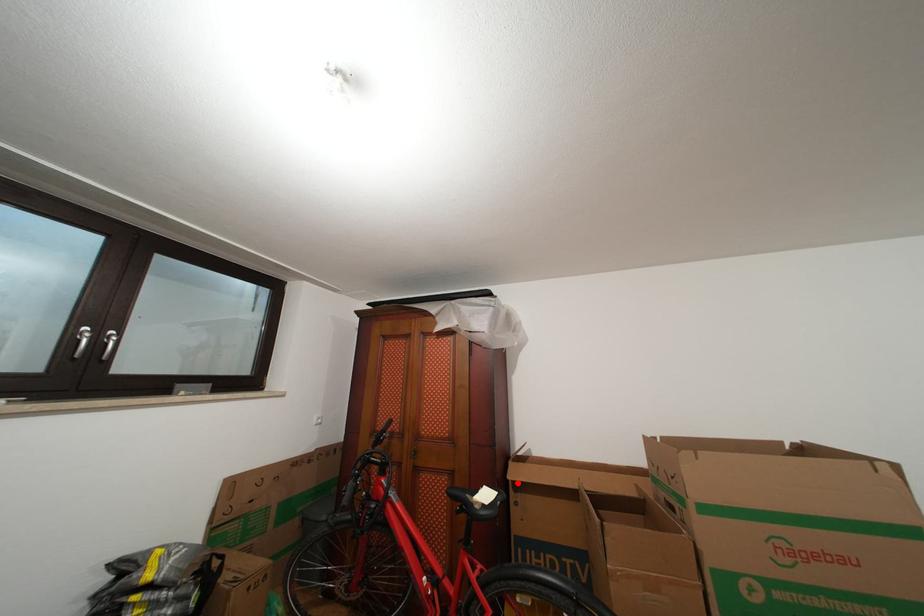
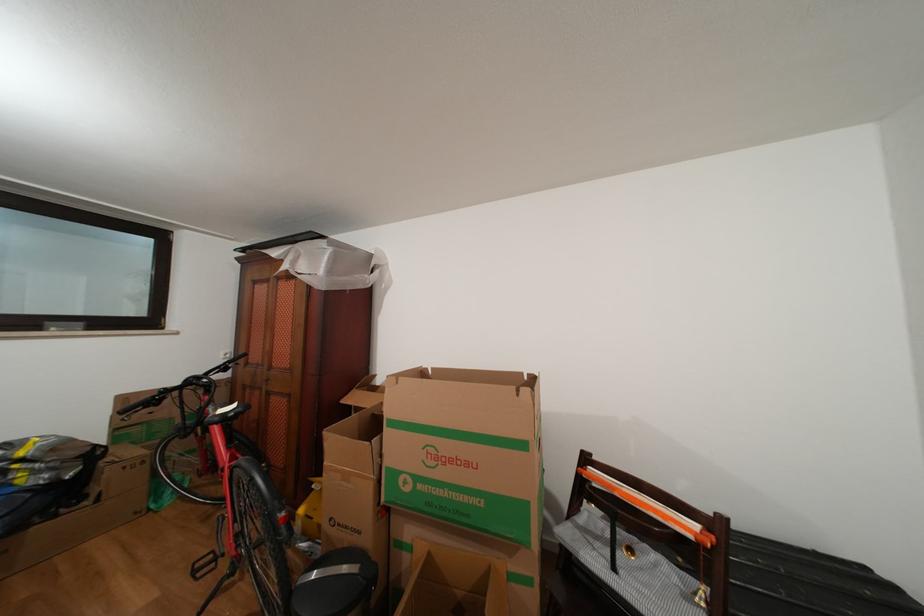
Find the pixel in the second image that matches the highlighted location in the first image.

(350, 407)